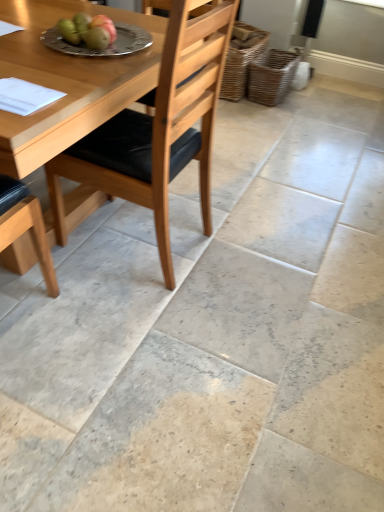
The image size is (384, 512). I want to click on vacant point to the right of green matte pear at upper left, which is the first fruit in right-to-left order, so click(x=132, y=55).